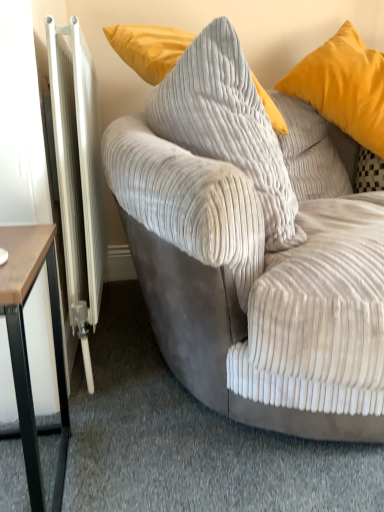
Question: Should I look upward or downward to see brown wood table at left?

Choices:
 (A) down
 (B) up

Answer: (A)

Question: Is white metallic radiator at left behind brown wood table at left?

Choices:
 (A) no
 (B) yes

Answer: (B)

Question: Can we say white metallic radiator at left lies outside brown wood table at left?

Choices:
 (A) no
 (B) yes

Answer: (B)

Question: From the image's perspective, would you say white metallic radiator at left is positioned over brown wood table at left?

Choices:
 (A) yes
 (B) no

Answer: (A)

Question: Is the depth of white metallic radiator at left less than that of brown wood table at left?

Choices:
 (A) no
 (B) yes

Answer: (A)

Question: From the image's perspective, does white metallic radiator at left appear lower than brown wood table at left?

Choices:
 (A) no
 (B) yes

Answer: (A)

Question: Does white metallic radiator at left appear on the left side of brown wood table at left?

Choices:
 (A) no
 (B) yes

Answer: (B)

Question: From the image's perspective, is white metallic radiator at left under matte yellow pillow at upper right, positioned as the 2th pillow in left-to-right order?

Choices:
 (A) yes
 (B) no

Answer: (A)

Question: Considering the relative sizes of white metallic radiator at left and matte yellow pillow at upper right, positioned as the 2th pillow in left-to-right order, in the image provided, is white metallic radiator at left shorter than matte yellow pillow at upper right, positioned as the 2th pillow in left-to-right order,?

Choices:
 (A) no
 (B) yes

Answer: (A)

Question: Can you confirm if white metallic radiator at left is thinner than matte yellow pillow at upper right, which appears as the first pillow when viewed from the right?

Choices:
 (A) yes
 (B) no

Answer: (A)

Question: Is white metallic radiator at left to the left of matte yellow pillow at upper right, positioned as the 2th pillow in left-to-right order, from the viewer's perspective?

Choices:
 (A) no
 (B) yes

Answer: (B)

Question: From the image's perspective, is white metallic radiator at left over matte yellow pillow at upper right, positioned as the 2th pillow in left-to-right order?

Choices:
 (A) no
 (B) yes

Answer: (A)

Question: Can you confirm if white metallic radiator at left is taller than matte yellow pillow at upper right, positioned as the 2th pillow in left-to-right order?

Choices:
 (A) no
 (B) yes

Answer: (B)

Question: Does white metallic radiator at left have a lesser height compared to corduroy pillow at center, which is the 2th pillow in right-to-left order?

Choices:
 (A) yes
 (B) no

Answer: (B)